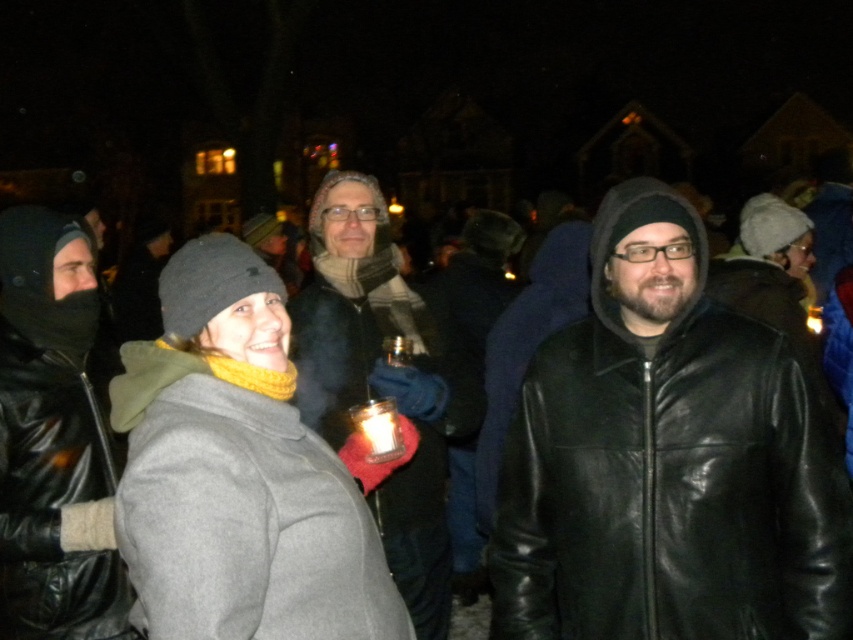
Is black leather jacket at left closer to the viewer compared to matte black jacket at center?

Yes, black leather jacket at left is closer to the viewer.

The width and height of the screenshot is (853, 640). Describe the element at coordinates (51, 448) in the screenshot. I see `black leather jacket at left` at that location.

Locate an element on the screen. black leather jacket at left is located at coordinates (51, 448).

Which is more to the left, shiny black leather jacket at center or matte black jacket at center?

Positioned to the left is matte black jacket at center.

Does shiny black leather jacket at center have a larger size compared to matte black jacket at center?

Incorrect, shiny black leather jacket at center is not larger than matte black jacket at center.

Find the location of a particular element. Image resolution: width=853 pixels, height=640 pixels. shiny black leather jacket at center is located at coordinates (666, 460).

Find the location of a particular element. The image size is (853, 640). shiny black leather jacket at center is located at coordinates (666, 460).

Is shiny black leather jacket at center above black leather jacket at left?

No.

At what (x,y) coordinates should I click in order to perform the action: click on shiny black leather jacket at center. Please return your answer as a coordinate pair (x, y). This screenshot has width=853, height=640. Looking at the image, I should click on (666, 460).